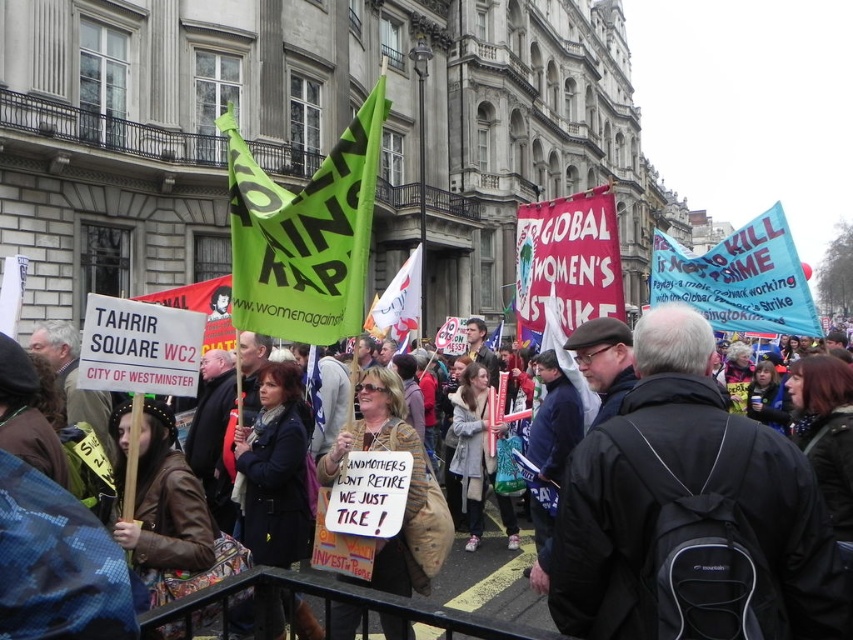
Question: Is green fabric flag at center above white fabric flag at center?

Choices:
 (A) no
 (B) yes

Answer: (B)

Question: Which point is closer to the camera?

Choices:
 (A) brown leather jacket at center
 (B) red fabric banner at center
 (C) dark brown leather jacket at center

Answer: (C)

Question: Is red fabric banner at center thinner than leather jacket at center?

Choices:
 (A) no
 (B) yes

Answer: (B)

Question: Which of the following is the closest to the observer?

Choices:
 (A) leather jacket at center
 (B) brown leather jacket at center
 (C) dark brown leather jacket at center
 (D) green fabric flag at center

Answer: (C)

Question: Which of the following is the closest to the observer?

Choices:
 (A) dark brown leather jacket at center
 (B) red fabric banner at center
 (C) green fabric flag at center
 (D) leather jacket at center

Answer: (A)

Question: Does dark brown leather jacket at center have a greater width compared to brown leather jacket at center?

Choices:
 (A) no
 (B) yes

Answer: (A)